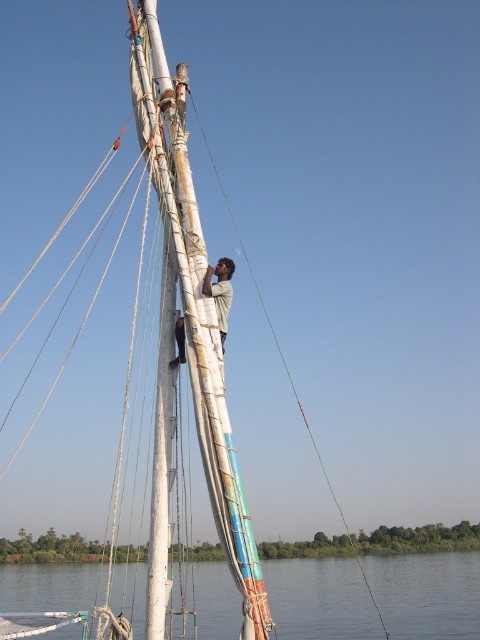
Is point (144, 586) closer to camera compared to point (219, 278)?

No, (144, 586) is behind (219, 278).

Can you confirm if transparent water at lower center is positioned to the right of light brown fabric shirt at center?

Incorrect, transparent water at lower center is not on the right side of light brown fabric shirt at center.

Is point (289, 632) positioned in front of point (213, 282)?

No.

You are a GUI agent. You are given a task and a screenshot of the screen. Output one action in this format:
    pyautogui.click(x=<x>, y=<y>)
    Task: Click on the transparent water at lower center
    The image size is (480, 640).
    Given the screenshot: What is the action you would take?
    coord(428,593)